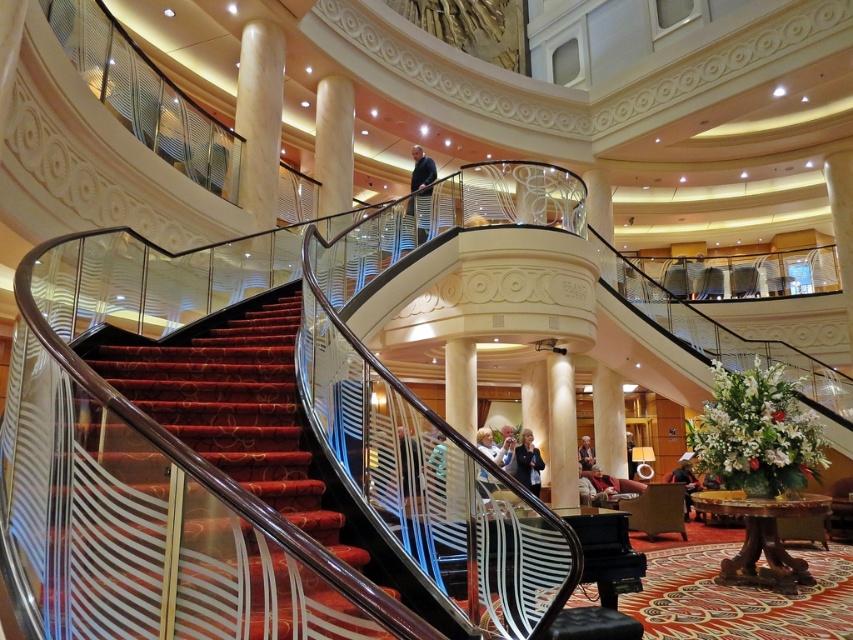
Question: From the image, what is the correct spatial relationship of velvet red stairs at center in relation to creamy marble column at upper center?

Choices:
 (A) right
 (B) left

Answer: (A)

Question: Does velvet red stairs at center appear on the left side of creamy marble column at upper center?

Choices:
 (A) no
 (B) yes

Answer: (A)

Question: Which of the following is the farthest from the observer?

Choices:
 (A) velvet red stairs at center
 (B) creamy marble column at upper center

Answer: (B)

Question: Which point is closer to the camera?

Choices:
 (A) creamy marble column at upper center
 (B) velvet red stairs at center

Answer: (B)

Question: Is velvet red stairs at center smaller than creamy marble column at upper center?

Choices:
 (A) no
 (B) yes

Answer: (A)